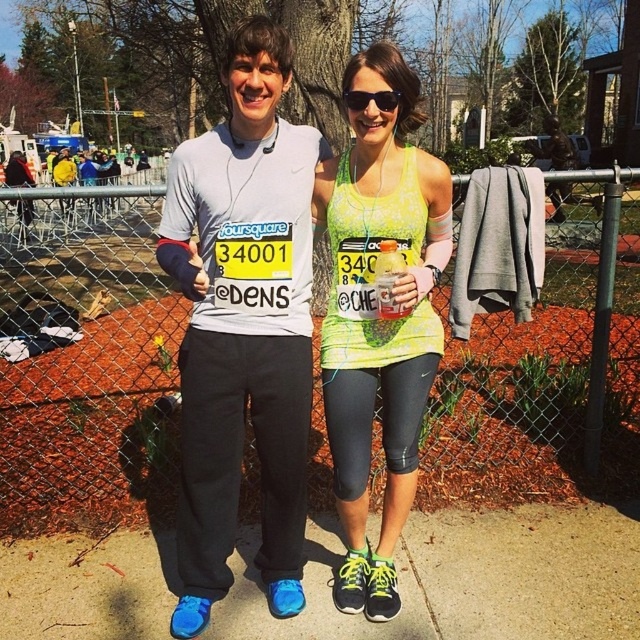
You are a photographer trying to capture both the smooth concrete pavement at center and the black plastic sunglasses at center in a single shot. Which object should you position closer to the left side of your camera frame?

The smooth concrete pavement at center should be positioned closer to the left side of your camera frame because it is located to the left of the black plastic sunglasses at center.